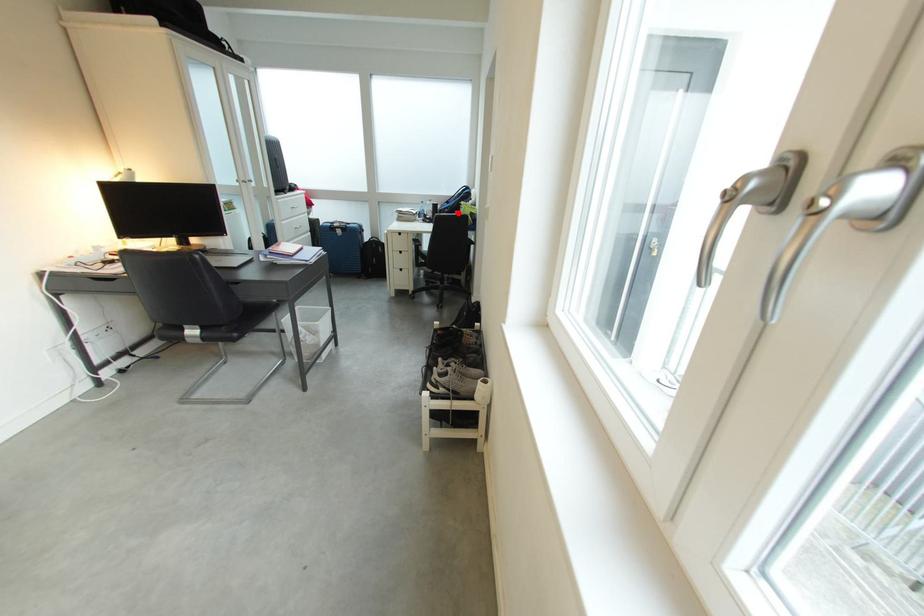
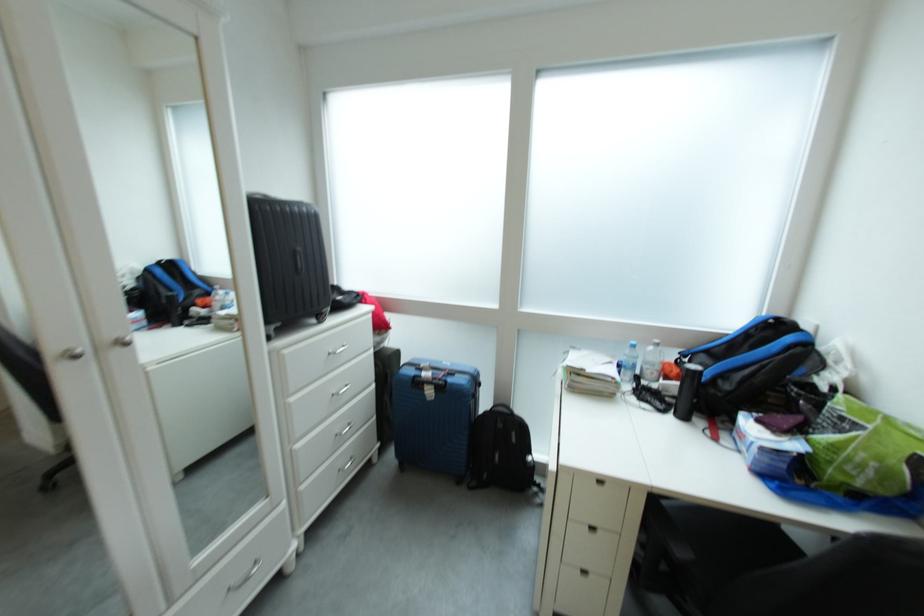
In the second image, find the point that corresponds to the highlighted location in the first image.

(737, 390)